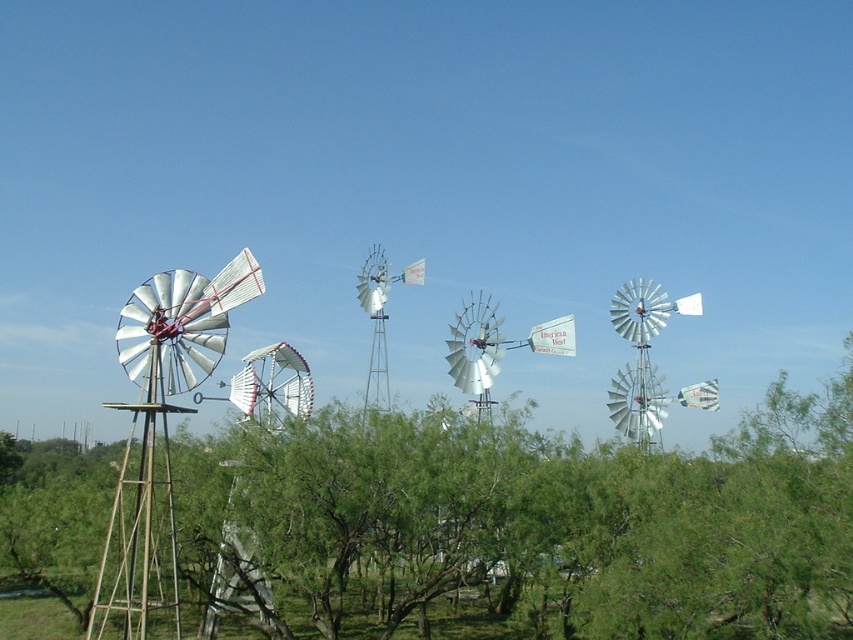
Can you confirm if green leafy tree at left is smaller than white metallic windmill at center?

Incorrect, green leafy tree at left is not smaller in size than white metallic windmill at center.

Is green leafy tree at left to the left of white metallic windmill at center from the viewer's perspective?

Yes, green leafy tree at left is to the left of white metallic windmill at center.

Where is `green leafy tree at left`? The width and height of the screenshot is (853, 640). green leafy tree at left is located at coordinates (543, 524).

Does silver metallic windmill at left have a greater height compared to white metallic windmill at center?

Indeed, silver metallic windmill at left has a greater height compared to white metallic windmill at center.

Is point (115, 545) positioned after point (373, 280)?

No, it is in front of (373, 280).

Which is behind, point (138, 323) or point (370, 307)?

The point (370, 307) is more distant.

This screenshot has width=853, height=640. In order to click on silver metallic windmill at left in this screenshot , I will do `click(160, 433)`.

Who is lower down, green leafy tree at left or silver metallic windmill at left?

green leafy tree at left is lower down.

Between point (281, 545) and point (144, 593), which one is positioned behind?

Point (281, 545)

This screenshot has height=640, width=853. In order to click on green leafy tree at left in this screenshot , I will do `click(543, 524)`.